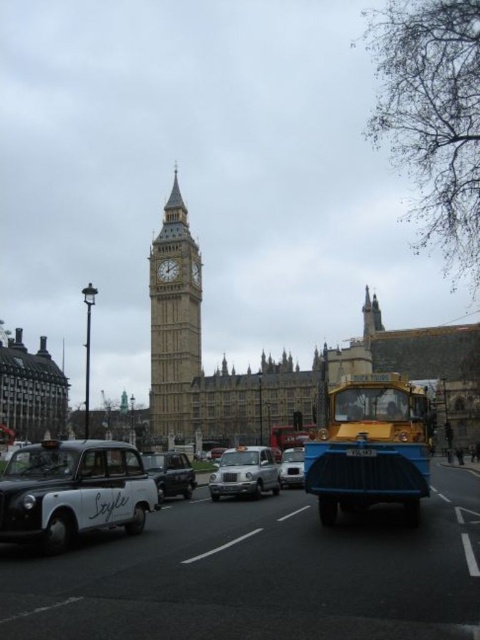
Question: Does yellow matte taxi at center appear on the right side of black plastic license plate at center?

Choices:
 (A) no
 (B) yes

Answer: (B)

Question: Is matte black taxi at lower left thinner than silver metallic taxi at center?

Choices:
 (A) yes
 (B) no

Answer: (B)

Question: Among these points, which one is farthest from the camera?

Choices:
 (A) (297, 449)
 (B) (402, 486)

Answer: (A)

Question: Among these objects, which one is farthest from the camera?

Choices:
 (A) black plastic license plate at center
 (B) matte black taxi at lower left
 (C) yellow matte taxi at center

Answer: (A)

Question: Does silver metallic taxi at center lie behind black plastic license plate at center?

Choices:
 (A) no
 (B) yes

Answer: (B)

Question: Estimate the real-world distances between objects in this image. Which object is closer to the beige stone clock tower at center?

Choices:
 (A) yellow matte taxi at center
 (B) matte black taxi at lower left
 (C) shiny black car at center
 (D) metallic silver van at center

Answer: (C)